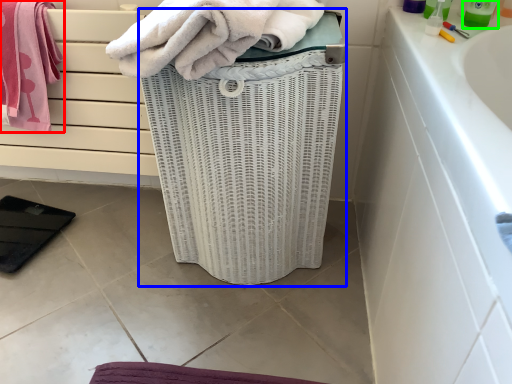
Question: Estimate the real-world distances between objects in this image. Which object is closer to towel (highlighted by a red box), basket container (highlighted by a blue box) or cleaning product (highlighted by a green box)?

Choices:
 (A) basket container
 (B) cleaning product

Answer: (A)